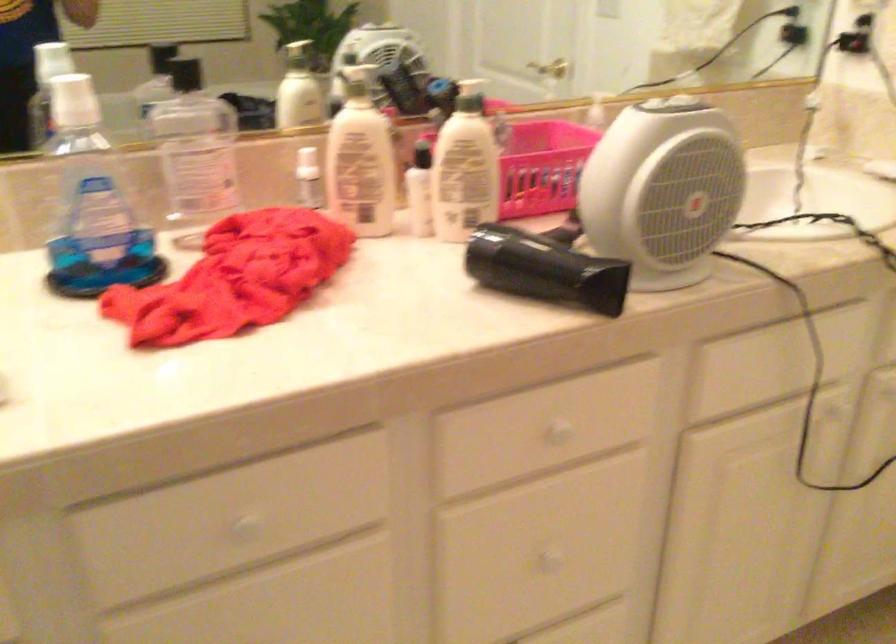
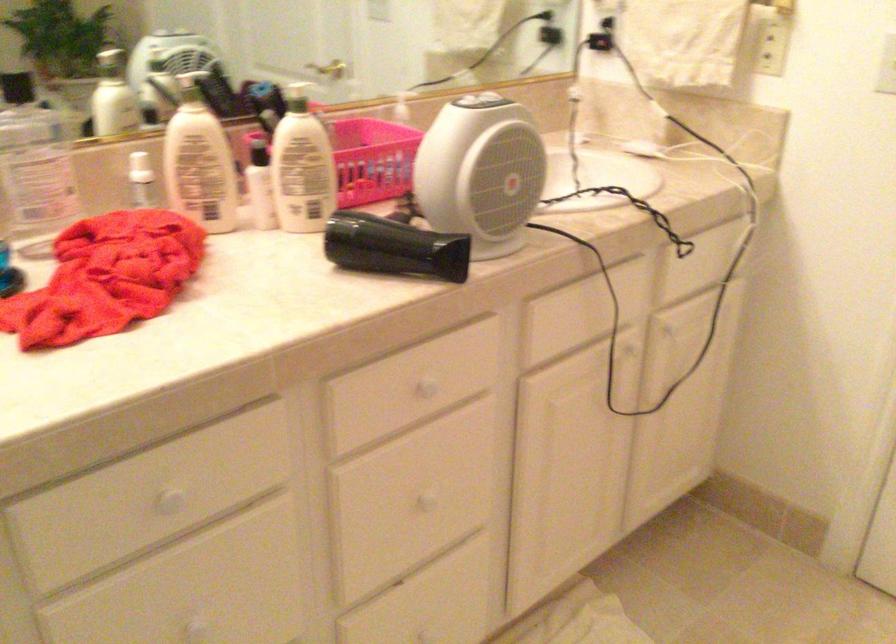
Locate, in the second image, the point that corresponds to (x=254, y=525) in the first image.

(169, 500)